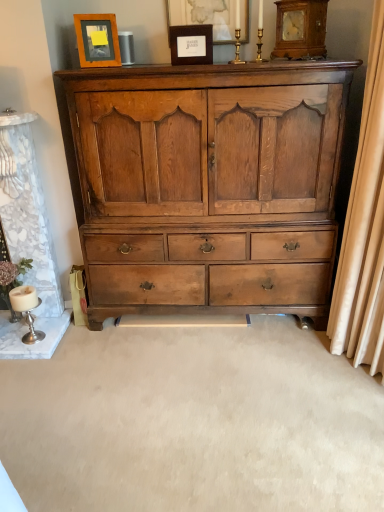
Question: Is beige fabric curtain at right further to camera compared to wooden frame at upper left, which is the 3th picture frame from right to left?

Choices:
 (A) yes
 (B) no

Answer: (B)

Question: Does beige fabric curtain at right turn towards wooden frame at upper left, the 1th picture frame viewed from the left?

Choices:
 (A) no
 (B) yes

Answer: (A)

Question: From a real-world perspective, is beige fabric curtain at right located higher than wooden frame at upper left, which is the 3th picture frame from right to left?

Choices:
 (A) yes
 (B) no

Answer: (B)

Question: Is beige fabric curtain at right not near wooden frame at upper left, which is the 3th picture frame from right to left?

Choices:
 (A) no
 (B) yes

Answer: (B)

Question: Considering the relative sizes of beige fabric curtain at right and wooden frame at upper left, which is the 3th picture frame from right to left, in the image provided, is beige fabric curtain at right bigger than wooden frame at upper left, which is the 3th picture frame from right to left,?

Choices:
 (A) no
 (B) yes

Answer: (B)

Question: Is point (87, 98) closer or farther from the camera than point (14, 308)?

Choices:
 (A) farther
 (B) closer

Answer: (B)

Question: Considering the positions of matte brown wooden chest of drawers at center and silver metallic candlestick at lower left in the image, is matte brown wooden chest of drawers at center taller or shorter than silver metallic candlestick at lower left?

Choices:
 (A) tall
 (B) short

Answer: (A)

Question: Is matte brown wooden chest of drawers at center bigger or smaller than silver metallic candlestick at lower left?

Choices:
 (A) big
 (B) small

Answer: (A)

Question: Would you say matte brown wooden chest of drawers at center is inside or outside silver metallic candlestick at lower left?

Choices:
 (A) outside
 (B) inside

Answer: (A)

Question: Looking at the image, does wooden frame at upper left, the 1th picture frame viewed from the left, seem bigger or smaller compared to silver metallic candlestick at lower left?

Choices:
 (A) small
 (B) big

Answer: (A)

Question: Is point (117, 60) positioned closer to the camera than point (11, 289)?

Choices:
 (A) closer
 (B) farther

Answer: (A)

Question: From a real-world perspective, relative to silver metallic candlestick at lower left, is wooden frame at upper left, which is the 3th picture frame from right to left, vertically above or below?

Choices:
 (A) below
 (B) above

Answer: (B)

Question: In terms of height, does wooden frame at upper left, which is the 3th picture frame from right to left, look taller or shorter compared to silver metallic candlestick at lower left?

Choices:
 (A) tall
 (B) short

Answer: (B)

Question: Considering the positions of wooden clock at upper right and matte brown wooden chest of drawers at center in the image, is wooden clock at upper right bigger or smaller than matte brown wooden chest of drawers at center?

Choices:
 (A) big
 (B) small

Answer: (B)

Question: From a real-world perspective, is wooden clock at upper right positioned above or below matte brown wooden chest of drawers at center?

Choices:
 (A) above
 (B) below

Answer: (A)